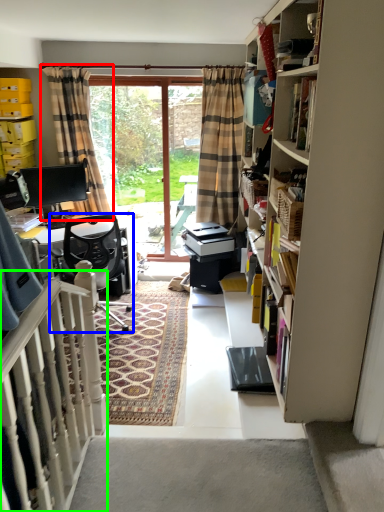
Question: Based on their relative distances, which object is nearer to curtain (highlighted by a red box)? Choose from chair (highlighted by a blue box) and balustrade (highlighted by a green box).

Choices:
 (A) chair
 (B) balustrade

Answer: (A)